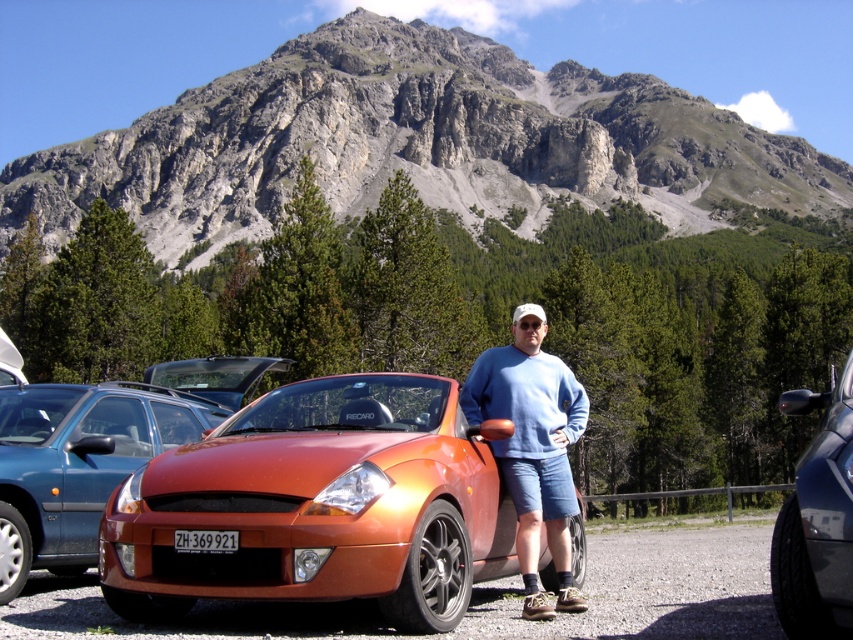
Question: Which point is closer to the camera?

Choices:
 (A) (241, 445)
 (B) (190, 548)

Answer: (B)

Question: Which point is farther from the camera taking this photo?

Choices:
 (A) (566, 422)
 (B) (799, 568)
 (C) (234, 540)

Answer: (A)

Question: Observing the image, what is the correct spatial positioning of metallic orange car at center in reference to blue cotton sweater at center?

Choices:
 (A) below
 (B) above

Answer: (A)

Question: Does rugged stone mountain at upper center have a lesser width compared to orange metallic car at center?

Choices:
 (A) no
 (B) yes

Answer: (A)

Question: Observing the image, what is the correct spatial positioning of rugged stone mountain at upper center in reference to shiny orange sports car at center?

Choices:
 (A) right
 (B) left

Answer: (A)

Question: Estimate the real-world distances between objects in this image. Which object is farther from the blue cotton sweater at center?

Choices:
 (A) black plastic license plate at center
 (B) glossy metallic car at center

Answer: (B)